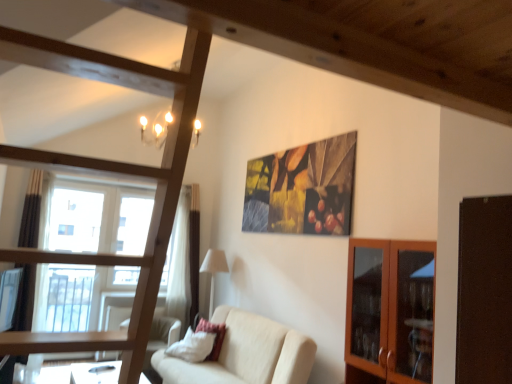
In order to face beige fabric couch at center, should I rotate leftwards or rightwards?

Rotate left and turn 4.787 degrees.

This screenshot has width=512, height=384. What do you see at coordinates (115, 173) in the screenshot?
I see `wooden frame bunk bed at center` at bounding box center [115, 173].

Image resolution: width=512 pixels, height=384 pixels. Describe the element at coordinates (393, 311) in the screenshot. I see `wooden glass cabinet at right` at that location.

Measure the distance between point (209,357) and camera.

Point (209,357) is 4.52 meters from camera.

This screenshot has width=512, height=384. What are the coordinates of `white fabric lampshade at center` in the screenshot? It's located at (213, 271).

Can you confirm if wooden glass cabinet at right is bigger than beige fabric couch at center?

No, wooden glass cabinet at right is not bigger than beige fabric couch at center.

Is wooden glass cabinet at right inside or outside of beige fabric couch at center?

wooden glass cabinet at right is not enclosed by beige fabric couch at center.

Which is closer to the camera, (391, 306) or (229, 348)?

Point (391, 306) is positioned closer to the camera compared to point (229, 348).

Which is in front, wooden glass cabinet at right or beige fabric couch at center?

wooden glass cabinet at right is more forward.

At what (x,y) coordinates should I click in order to perform the action: click on cabinetry in front of the velvet red pillow at lower center. Please return your answer as a coordinate pair (x, y). Image resolution: width=512 pixels, height=384 pixels. Looking at the image, I should click on (393, 311).

Can you see velvet red pillow at lower center touching wooden glass cabinet at right?

They are not placed beside each other.

Would you say velvet red pillow at lower center is to the left or to the right of wooden glass cabinet at right in the picture?

Based on their positions, velvet red pillow at lower center is located to the left of wooden glass cabinet at right.

Is velvet red pillow at lower center to the right of wooden frame bunk bed at center from the viewer's perspective?

Correct, you'll find velvet red pillow at lower center to the right of wooden frame bunk bed at center.

Is velvet red pillow at lower center oriented towards wooden frame bunk bed at center?

No.

Considering the sizes of objects velvet red pillow at lower center and wooden frame bunk bed at center in the image provided, who is taller, velvet red pillow at lower center or wooden frame bunk bed at center?

wooden frame bunk bed at center.

From a real-world perspective, who is located lower, velvet red pillow at lower center or wooden frame bunk bed at center?

velvet red pillow at lower center, from a real-world perspective.

How far apart are wooden frame bunk bed at center and beige fabric couch at center?

wooden frame bunk bed at center is 8.45 feet from beige fabric couch at center.

Considering the sizes of wooden frame bunk bed at center and beige fabric couch at center in the image, is wooden frame bunk bed at center wider or thinner than beige fabric couch at center?

Considering their sizes, wooden frame bunk bed at center looks broader than beige fabric couch at center.

Which is more to the left, wooden frame bunk bed at center or beige fabric couch at center?

wooden frame bunk bed at center.

Do you think wooden frame bunk bed at center is within beige fabric couch at center, or outside of it?

wooden frame bunk bed at center is not enclosed by beige fabric couch at center.

How many degrees apart are the facing directions of wooden frame bunk bed at center and velvet red pillow at lower center?

There is a 88.6-degree angle between the facing directions of wooden frame bunk bed at center and velvet red pillow at lower center.

From the image's perspective, between wooden frame bunk bed at center and velvet red pillow at lower center, which one is located above?

wooden frame bunk bed at center is shown above in the image.

Is wooden frame bunk bed at center oriented away from velvet red pillow at lower center?

No, wooden frame bunk bed at center's orientation is not away from velvet red pillow at lower center.

Consider the image. Which object is closer to the camera taking this photo, wooden frame bunk bed at center or velvet red pillow at lower center?

wooden frame bunk bed at center is closer to the camera.

What's the angular difference between velvet red pillow at lower center and beige fabric couch at center's facing directions?

The facing directions of velvet red pillow at lower center and beige fabric couch at center are 0.904 degrees apart.

From a real-world perspective, is velvet red pillow at lower center under beige fabric couch at center?

No.

Based on their sizes in the image, would you say velvet red pillow at lower center is bigger or smaller than beige fabric couch at center?

velvet red pillow at lower center is smaller than beige fabric couch at center.

Could you tell me if velvet red pillow at lower center is facing beige fabric couch at center?

Yes, velvet red pillow at lower center is oriented towards beige fabric couch at center.

Can velvet red pillow at lower center be found inside white fabric lampshade at center?

No, velvet red pillow at lower center is located outside of white fabric lampshade at center.

Image resolution: width=512 pixels, height=384 pixels. Find the location of `pillow located underneath the white fabric lampshade at center (from a real-world perspective)`. pillow located underneath the white fabric lampshade at center (from a real-world perspective) is located at coordinates (211, 332).

Based on the photo, from the image's perspective, is white fabric lampshade at center above or below velvet red pillow at lower center?

white fabric lampshade at center is situated higher than velvet red pillow at lower center in the image.

Where is `cabinetry on the right of beige fabric couch at center`? The height and width of the screenshot is (384, 512). cabinetry on the right of beige fabric couch at center is located at coordinates (393, 311).

You are a GUI agent. You are given a task and a screenshot of the screen. Output one action in this format:
    pyautogui.click(x=<x>, y=<y>)
    Task: Click on the cabinetry that is above the velvet red pillow at lower center (from a real-world perspective)
    This screenshot has width=512, height=384.
    Given the screenshot: What is the action you would take?
    pyautogui.click(x=393, y=311)

Considering their positions, is wooden glass cabinet at right positioned further to wooden frame bunk bed at center than white fabric lampshade at center?

white fabric lampshade at center is further to wooden frame bunk bed at center.

From the image, which object appears to be farther from beige fabric couch at center, wooden frame bunk bed at center or wooden glass cabinet at right?

wooden frame bunk bed at center is positioned further to the anchor beige fabric couch at center.

Which object lies nearer to the anchor point white fabric lampshade at center, beige fabric couch at center or velvet red pillow at lower center?

velvet red pillow at lower center is closer to white fabric lampshade at center.

Based on their spatial positions, is wooden glass cabinet at right or white fabric lampshade at center closer to velvet red pillow at lower center?

The object closer to velvet red pillow at lower center is white fabric lampshade at center.

Based on the photo, estimate the real-world distances between objects in this image. Which object is further from white fabric lampshade at center, wooden frame bunk bed at center or wooden glass cabinet at right?

Among the two, wooden frame bunk bed at center is located further to white fabric lampshade at center.

From the image, which object appears to be nearer to velvet red pillow at lower center, wooden glass cabinet at right or beige fabric couch at center?

The object closer to velvet red pillow at lower center is beige fabric couch at center.

Estimate the real-world distances between objects in this image. Which object is further from white fabric lampshade at center, velvet red pillow at lower center or wooden frame bunk bed at center?

Based on the image, wooden frame bunk bed at center appears to be further to white fabric lampshade at center.

Considering their positions, is velvet red pillow at lower center positioned further to wooden frame bunk bed at center than wooden glass cabinet at right?

velvet red pillow at lower center.

Find the location of `studio couch between wooden glass cabinet at right and white fabric lampshade at center along the z-axis`. studio couch between wooden glass cabinet at right and white fabric lampshade at center along the z-axis is located at coordinates (246, 354).

Identify the location of cabinetry between wooden frame bunk bed at center and white fabric lampshade at center in the front-back direction. This screenshot has height=384, width=512. (393, 311).

You are a GUI agent. You are given a task and a screenshot of the screen. Output one action in this format:
    pyautogui.click(x=<x>, y=<y>)
    Task: Click on the pillow between beige fabric couch at center and white fabric lampshade at center along the z-axis
    Image resolution: width=512 pixels, height=384 pixels.
    Given the screenshot: What is the action you would take?
    pyautogui.click(x=211, y=332)

The height and width of the screenshot is (384, 512). Find the location of `cabinetry positioned between wooden frame bunk bed at center and velvet red pillow at lower center from near to far`. cabinetry positioned between wooden frame bunk bed at center and velvet red pillow at lower center from near to far is located at coordinates (393, 311).